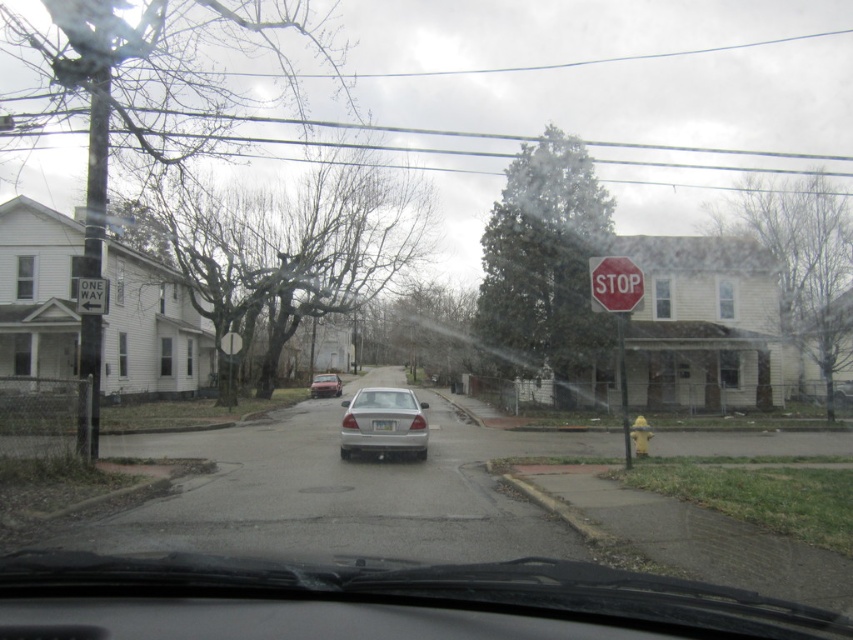
You are driving a car and need to check the distance between the red matte stop sign at upper right and the clear glass windshield at center. Which object is closer to you from your current position inside the vehicle?

The clear glass windshield at center is closer to you because it is located at the center of your view, while the red matte stop sign at upper right is positioned further to the right and outside the vehicle.

You are driving a car and need to check the distance between the white plastic one way sign at upper left and the matte silver sedan at center. Which object is nearer to your current position?

The white plastic one way sign at upper left is closer to the viewer than the matte silver sedan at center, so it is nearer to your current position.